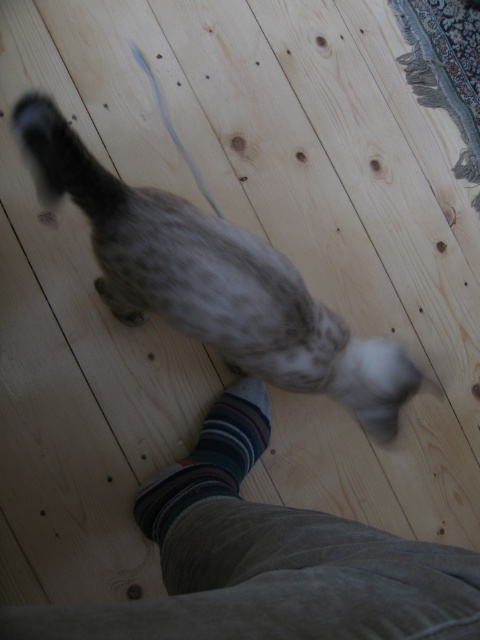
You are a photographer trying to capture the striped cotton sock at lower center and the fluffy gray tail at lower left in the same frame. Which object should you focus on first if you want to ensure both are in focus?

The striped cotton sock at lower center should be focused on first because it is larger in size compared to the fluffy gray tail at lower left, which means it will require more precise focusing to maintain clarity.

You are trying to decide which sock to wear today. You see a striped sock at lower center and a striped cotton sock at lower center in the image. Which one is bigger?

The striped sock at lower center is larger in size compared to the striped cotton sock at lower center.

You are a photographer trying to focus on the striped sock at lower center and the striped cotton sock at lower center. Which sock should you adjust your camera focus to first if you want to capture both clearly?

You should focus on the striped sock at lower center first because it is closer to the viewer than the striped cotton sock at lower center, ensuring both are in focus when using a shallow depth of field.